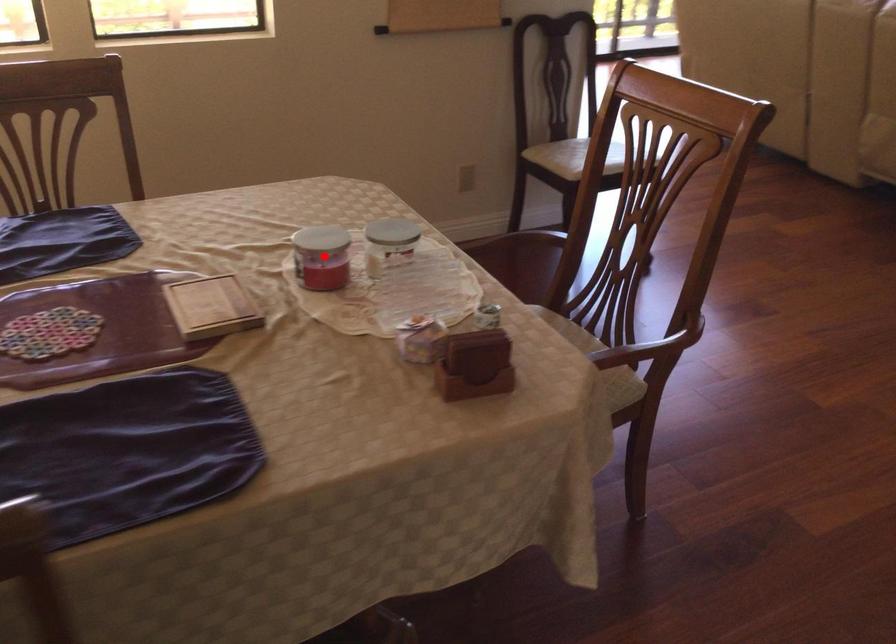
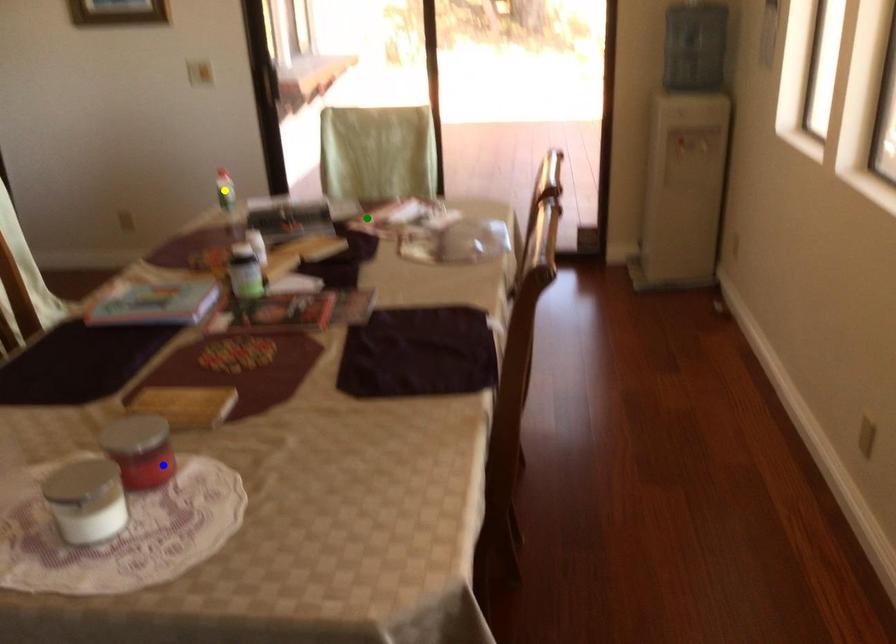
Question: I am providing you with two images of the same scene from different viewpoints. A red point is marked on the first image. You are given multiple points on the second image. In image 2, which mark is for the same physical point as the one in image 1?

Choices:
 (A) yellow point
 (B) green point
 (C) blue point

Answer: (C)